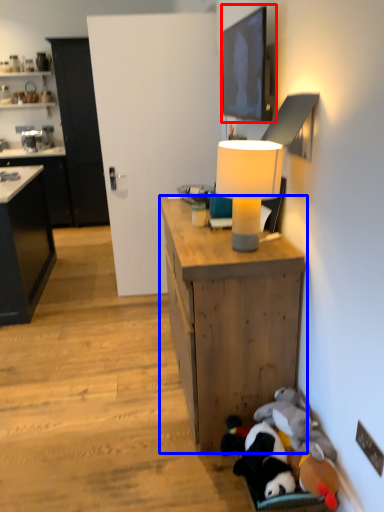
Question: Which object is closer to the camera taking this photo, picture frame (highlighted by a red box) or desk (highlighted by a blue box)?

Choices:
 (A) picture frame
 (B) desk

Answer: (B)